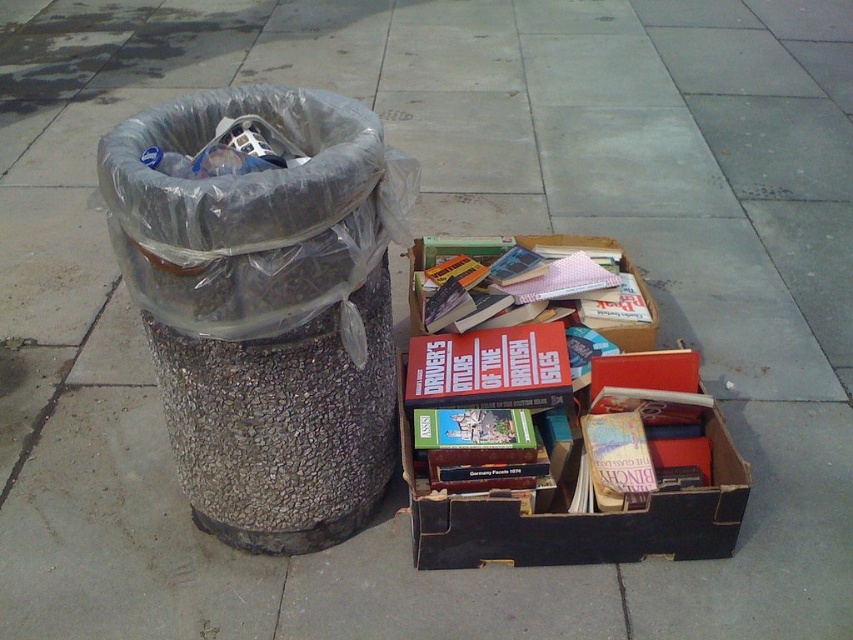
Question: Is clear plastic trash can at left wider than cardboard box at center?

Choices:
 (A) yes
 (B) no

Answer: (B)

Question: Which point is closer to the camera?

Choices:
 (A) cardboard box at center
 (B) clear plastic trash can at left

Answer: (B)

Question: Does clear plastic trash can at left have a greater width compared to cardboard box at center?

Choices:
 (A) no
 (B) yes

Answer: (A)

Question: Does clear plastic trash can at left appear on the right side of cardboard box at center?

Choices:
 (A) yes
 (B) no

Answer: (B)